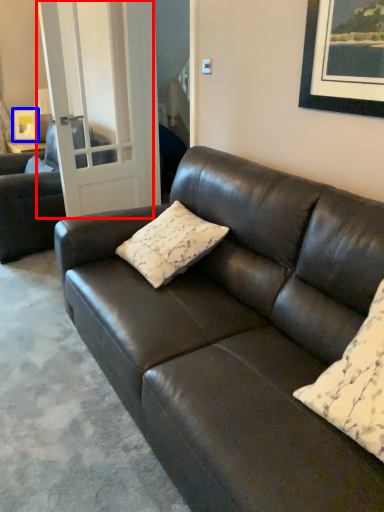
Question: Which object is closer to the camera taking this photo, glass door (highlighted by a red box) or picture frame (highlighted by a blue box)?

Choices:
 (A) glass door
 (B) picture frame

Answer: (A)